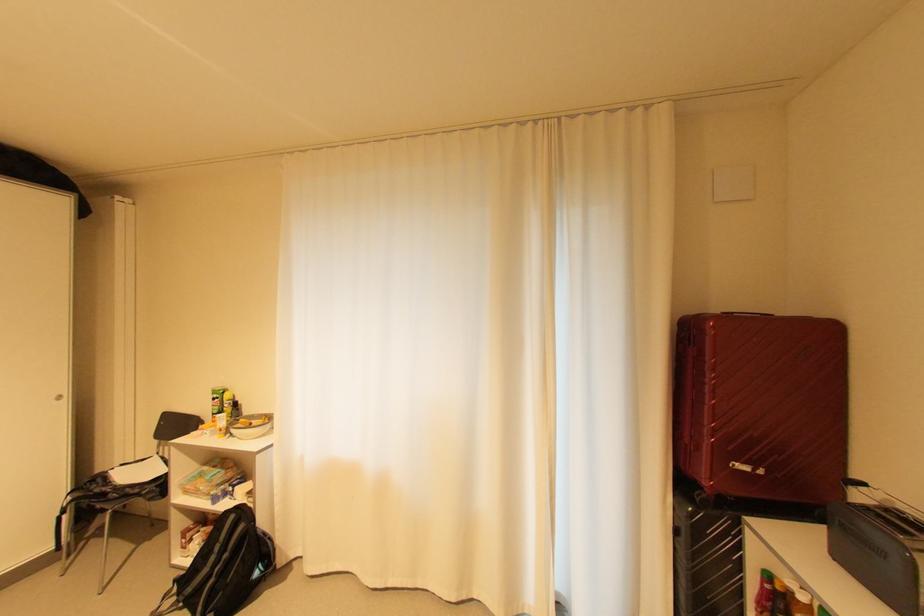
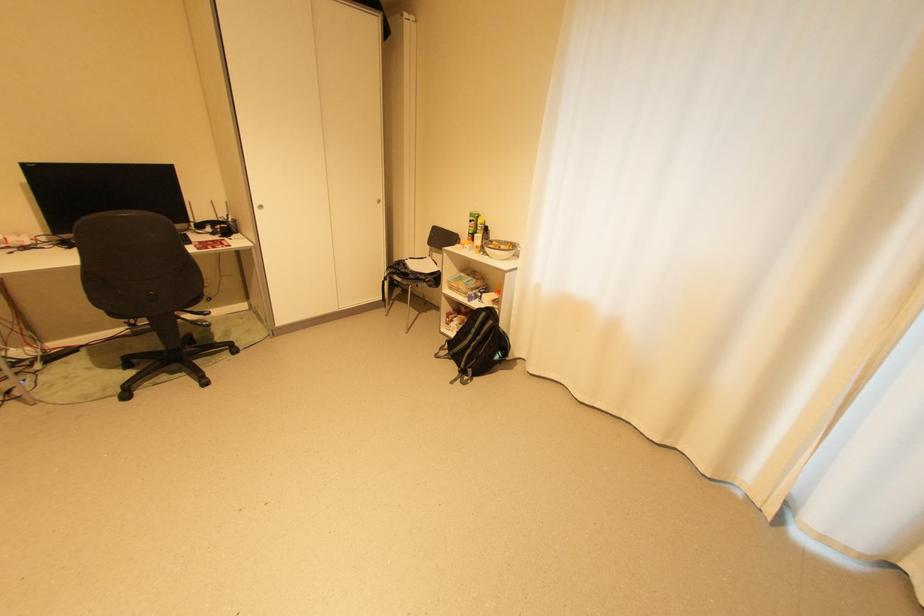
In the second image, find the point that corresponds to the point at 225,400 in the first image.

(480, 223)